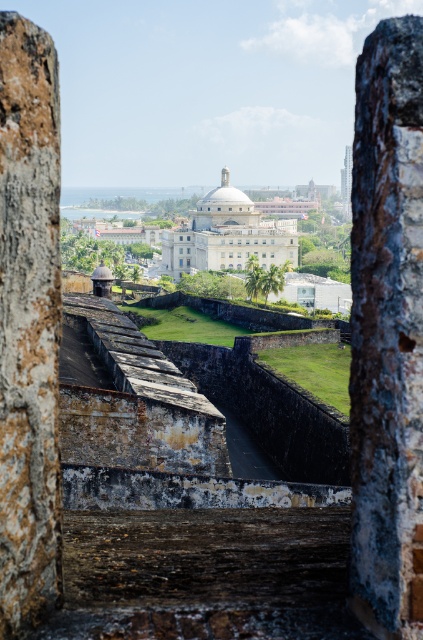
You are standing at the point marked as point (346, 176) in the image. What structure are you facing?

You are facing the smooth concrete tower at center.

You are a tourist standing at the wooden railing inside the historic fortification. You notice two features ahead of you in the view outside the fort. The first is the white smooth building at center, and the second is the transparent glass window at center. Which of these two objects appears wider from your current viewpoint?

The white smooth building at center appears wider than the transparent glass window at center because its width surpasses that of the window.